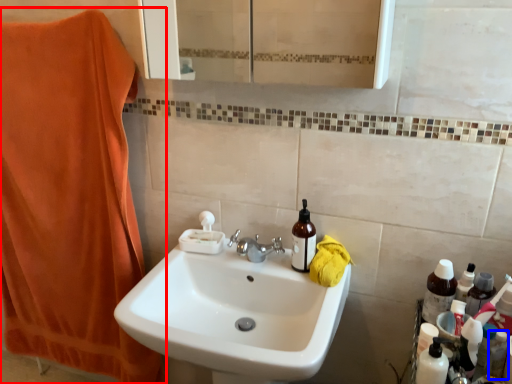
Question: Which object is closer to the camera taking this photo, beach towel (highlighted by a red box) or toiletry (highlighted by a blue box)?

Choices:
 (A) beach towel
 (B) toiletry

Answer: (B)